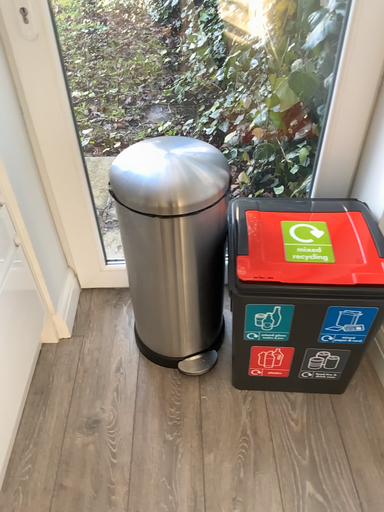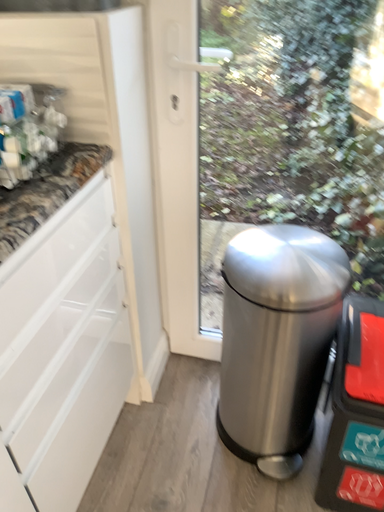
Question: How did the camera likely rotate when shooting the video?

Choices:
 (A) rotated left
 (B) rotated right

Answer: (A)